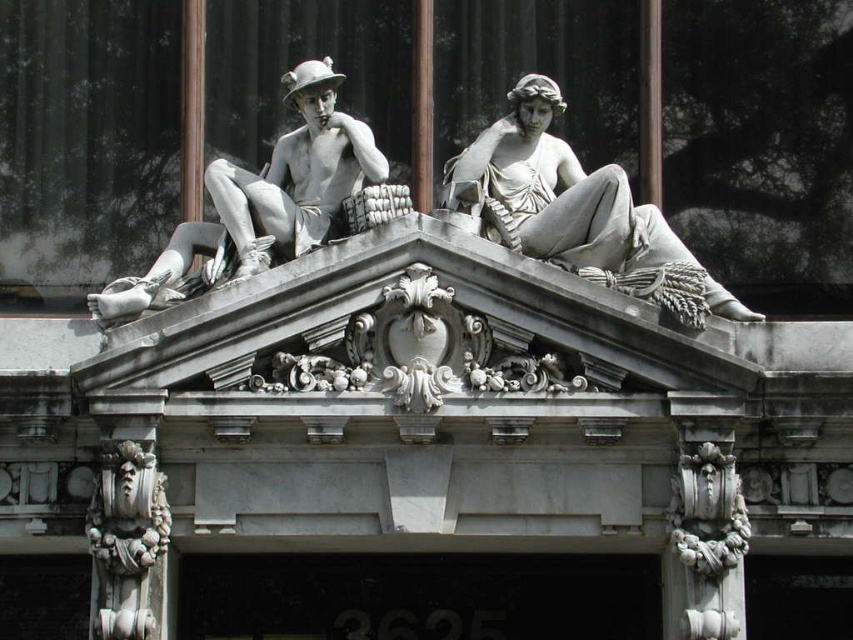
I want to click on white marble statue at upper right, so click(x=581, y=211).

Does white marble statue at upper right appear on the right side of matte stone statue at upper left?

Indeed, white marble statue at upper right is positioned on the right side of matte stone statue at upper left.

Where is `white marble statue at upper right`? white marble statue at upper right is located at coordinates (581, 211).

Who is higher up, white marble statue at upper right or white stone decorative element at lower left?

white marble statue at upper right is above.

Who is positioned more to the left, white marble statue at upper right or white stone decorative element at lower left?

From the viewer's perspective, white stone decorative element at lower left appears more on the left side.

Is point (741, 308) less distant than point (146, 509)?

That is False.

Locate an element on the screen. The width and height of the screenshot is (853, 640). white marble statue at upper right is located at coordinates click(581, 211).

Who is shorter, matte stone statue at upper left or white stone decorative element at lower left?

white stone decorative element at lower left

Does matte stone statue at upper left appear on the right side of white stone decorative element at lower left?

Answer: Correct, you'll find matte stone statue at upper left to the right of white stone decorative element at lower left.

Does point (340, 164) lie in front of point (149, 616)?

No.

I want to click on matte stone statue at upper left, so click(x=263, y=198).